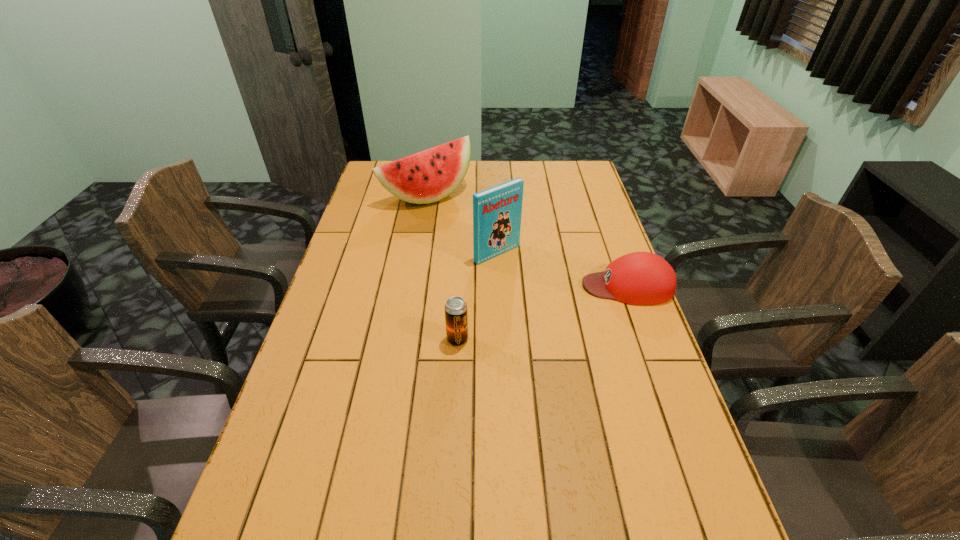
Where is `free spot between the rightmost object and the beer can`? The height and width of the screenshot is (540, 960). free spot between the rightmost object and the beer can is located at coordinates (542, 313).

Image resolution: width=960 pixels, height=540 pixels. I want to click on blank region between the second farthest object and the second tallest object, so click(x=462, y=225).

Identify the location of free space between the farthest object and the second nearest object. (527, 241).

Where is `vacant area that lies between the third farthest object and the third object from left to right`? The width and height of the screenshot is (960, 540). vacant area that lies between the third farthest object and the third object from left to right is located at coordinates (563, 269).

Where is `vacant space that is in between the beer can and the second farthest object`? Image resolution: width=960 pixels, height=540 pixels. vacant space that is in between the beer can and the second farthest object is located at coordinates (477, 296).

Identify the location of empty space that is in between the beer can and the shortest object. Image resolution: width=960 pixels, height=540 pixels. (542, 313).

Identify the location of object that is the third closest to the watermelon. (456, 317).

Locate which object ranks third in proximity to the book. Please provide its 2D coordinates. Your answer should be formatted as a tuple, i.e. [(x, y)], where the tuple contains the x and y coordinates of a point satisfying the conditions above.

[(456, 317)]

Locate an element on the screen. The width and height of the screenshot is (960, 540). vacant space that satisfies the following two spatial constraints: 1. on the back side of the beer can; 2. on the front-facing side of the baseball cap is located at coordinates (460, 286).

The width and height of the screenshot is (960, 540). I want to click on free region that satisfies the following two spatial constraints: 1. on the front side of the book; 2. on the front-facing side of the rightmost object, so click(498, 286).